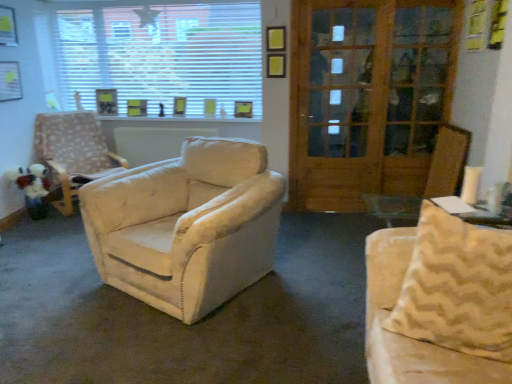
Question: Is white plush toy at left positioned before beige fabric armchair at left?

Choices:
 (A) yes
 (B) no

Answer: (B)

Question: Is white plush toy at left outside beige fabric armchair at left?

Choices:
 (A) no
 (B) yes

Answer: (B)

Question: Is white plush toy at left at the right side of beige fabric armchair at left?

Choices:
 (A) yes
 (B) no

Answer: (B)

Question: From the image's perspective, is white plush toy at left located beneath beige fabric armchair at left?

Choices:
 (A) yes
 (B) no

Answer: (A)

Question: Does white plush toy at left have a smaller size compared to beige fabric armchair at left?

Choices:
 (A) no
 (B) yes

Answer: (B)

Question: From a real-world perspective, is wooden door at center physically located above or below wooden screen door at right?

Choices:
 (A) above
 (B) below

Answer: (B)

Question: From their relative heights in the image, would you say wooden door at center is taller or shorter than wooden screen door at right?

Choices:
 (A) short
 (B) tall

Answer: (B)

Question: Is wooden door at center bigger or smaller than wooden screen door at right?

Choices:
 (A) big
 (B) small

Answer: (B)

Question: Based on their positions, is wooden door at center located to the left or right of wooden screen door at right?

Choices:
 (A) left
 (B) right

Answer: (B)

Question: Does point (117, 26) appear closer or farther from the camera than point (377, 145)?

Choices:
 (A) farther
 (B) closer

Answer: (A)

Question: From the image's perspective, is white blinds at upper center located above or below wooden door at center?

Choices:
 (A) above
 (B) below

Answer: (A)

Question: Relative to wooden door at center, is white blinds at upper center in front or behind?

Choices:
 (A) behind
 (B) front

Answer: (A)

Question: Looking at the image, does white blinds at upper center seem bigger or smaller compared to wooden door at center?

Choices:
 (A) small
 (B) big

Answer: (A)

Question: Is white plush toy at left inside the boundaries of wooden screen door at right, or outside?

Choices:
 (A) outside
 (B) inside

Answer: (A)

Question: From the image's perspective, relative to wooden screen door at right, is white plush toy at left above or below?

Choices:
 (A) above
 (B) below

Answer: (B)